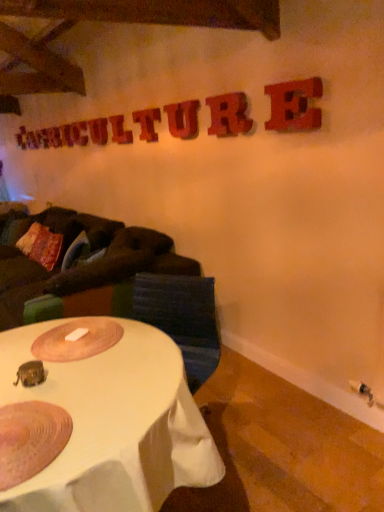
What do you see at coordinates (113, 425) in the screenshot? This screenshot has height=512, width=384. I see `white glossy table at lower left` at bounding box center [113, 425].

Where is `wooden letter at upper center, arranged as the fourth letter when viewed from the right`? The height and width of the screenshot is (512, 384). wooden letter at upper center, arranged as the fourth letter when viewed from the right is located at coordinates (147, 123).

What do you see at coordinates (67, 135) in the screenshot? I see `wooden letter at upper left, the first letter positioned from the back` at bounding box center [67, 135].

The height and width of the screenshot is (512, 384). What are the coordinates of `textured multicolored pillow at left` in the screenshot? It's located at (41, 245).

Where is `wooden sign at upper center, acting as the seventh letter starting from the front`? wooden sign at upper center, acting as the seventh letter starting from the front is located at coordinates (79, 133).

Measure the distance between point (82, 125) and camera.

The distance of point (82, 125) from camera is 14.40 feet.

Where is `white glossy table at lower left`? white glossy table at lower left is located at coordinates (113, 425).

Is point (207, 353) closer or farther from the camera than point (86, 127)?

Point (207, 353) appears to be closer to the viewer than point (86, 127).

Considering the sizes of objects textured fabric swivel chair at center and wooden sign at upper center, the 7th letter viewed from the right, in the image provided, who is bigger, textured fabric swivel chair at center or wooden sign at upper center, the 7th letter viewed from the right,?

textured fabric swivel chair at center is bigger.

Locate an element on the screen. swivel chair in front of the wooden sign at upper center, which appears as the second letter when viewed from the back is located at coordinates (182, 318).

Does textured fabric swivel chair at center have a lesser width compared to wooden sign at upper center, acting as the seventh letter starting from the front?

No.

From a real-world perspective, is rusty metal letter e at upper right, the 1th letter positioned from the front, on top of white glossy table at lower left?

Yes.

Can you confirm if rusty metal letter e at upper right, which is the 8th letter from left to right, is taller than white glossy table at lower left?

No.

From the image's perspective, between rusty metal letter e at upper right, the 1th letter positioned from the front, and white glossy table at lower left, who is located below?

white glossy table at lower left appears lower in the image.

Between rusty metal letter e at upper right, the 1th letter positioned from the front, and white glossy table at lower left, which one has smaller size?

With smaller size is rusty metal letter e at upper right, the 1th letter positioned from the front.

Are textured multicolored pillow at left and wooden letter at upper center, positioned as the fifth letter in back-to-front order, making contact?

No.

Between textured multicolored pillow at left and wooden letter at upper center, positioned as the fifth letter in back-to-front order, which one is positioned in front?

wooden letter at upper center, positioned as the fifth letter in back-to-front order, is closer to the camera.

From the image's perspective, does textured multicolored pillow at left appear lower than wooden letter at upper center, which is counted as the 5th letter, starting from the left?

Yes.

Is wooden letter at upper center, positioned as the fifth letter in back-to-front order, inside textured multicolored pillow at left?

No, wooden letter at upper center, positioned as the fifth letter in back-to-front order, is not surrounded by textured multicolored pillow at left.

Looking at this image, would you say wooden letter at upper center, the 4th letter positioned from the left, is part of wooden sign at upper center, the 7th letter viewed from the right,'s contents?

Actually, wooden letter at upper center, the 4th letter positioned from the left, is outside wooden sign at upper center, the 7th letter viewed from the right.

In the scene shown: Which object is positioned more to the right, wooden sign at upper center, acting as the seventh letter starting from the front, or wooden letter at upper center, the 4th letter positioned from the left?

wooden letter at upper center, the 4th letter positioned from the left, is more to the right.

How many degrees apart are the facing directions of wooden sign at upper center, the second letter when ordered from left to right, and wooden letter at upper center, which is the fifth letter from right to left?

The facing directions of wooden sign at upper center, the second letter when ordered from left to right, and wooden letter at upper center, which is the fifth letter from right to left, are 0.0197 degrees apart.

Consider the image. Could you tell me if rustic wood letter at upper center, the third letter when ordered from front to back, is facing wooden letter at upper center, the 4th letter positioned from the left?

No, rustic wood letter at upper center, the third letter when ordered from front to back, is not facing towards wooden letter at upper center, the 4th letter positioned from the left.

How different are the orientations of rustic wood letter at upper center, marked as the third letter in a right-to-left arrangement, and wooden letter at upper center, the fourth letter viewed from the back, in degrees?

The angle between the facing direction of rustic wood letter at upper center, marked as the third letter in a right-to-left arrangement, and the facing direction of wooden letter at upper center, the fourth letter viewed from the back, is 0.0303 degrees.

Can you confirm if rustic wood letter at upper center, the 6th letter viewed from the back, is wider than wooden letter at upper center, the 4th letter positioned from the left?

No, rustic wood letter at upper center, the 6th letter viewed from the back, is not wider than wooden letter at upper center, the 4th letter positioned from the left.

From the image's perspective, would you say rustic wood letter at upper center, the 6th letter viewed from the back, is positioned over wooden letter at upper center, the 5th letter in the front-to-back sequence?

No, from the image's perspective, rustic wood letter at upper center, the 6th letter viewed from the back, is not above wooden letter at upper center, the 5th letter in the front-to-back sequence.

Based on the photo, which object is wider, wooden letter at upper center, positioned as the sixth letter in right-to-left order, or dark brown fabric couch at left?

dark brown fabric couch at left.

Does wooden letter at upper center, the 6th letter from the front, touch dark brown fabric couch at left?

They are not placed beside each other.

Can you confirm if wooden letter at upper center, the 6th letter from the front, is positioned to the left of dark brown fabric couch at left?

In fact, wooden letter at upper center, the 6th letter from the front, is to the right of dark brown fabric couch at left.

Who is bigger, wooden letter at upper center, which is the 3th letter from back to front, or dark brown fabric couch at left?

dark brown fabric couch at left.

Considering the sizes of objects textured multicolored pillow at left and wooden sign at upper center, which appears as the second letter when viewed from the back, in the image provided, who is taller, textured multicolored pillow at left or wooden sign at upper center, which appears as the second letter when viewed from the back,?

textured multicolored pillow at left.

In terms of size, does textured multicolored pillow at left appear bigger or smaller than wooden sign at upper center, the second letter when ordered from left to right?

Clearly, textured multicolored pillow at left is larger in size than wooden sign at upper center, the second letter when ordered from left to right.

Based on the photo, from a real-world perspective, which is physically below, textured multicolored pillow at left or wooden sign at upper center, the second letter when ordered from left to right?

In real-world perspective, textured multicolored pillow at left is lower.

Where is `the 7th letter above the textured fabric swivel chair at center (from the image's perspective)`? This screenshot has width=384, height=512. the 7th letter above the textured fabric swivel chair at center (from the image's perspective) is located at coordinates (79, 133).

Where is `table that appears below the rusty metal letter e at upper right, which is the 8th letter from left to right (from a real-world perspective)`? table that appears below the rusty metal letter e at upper right, which is the 8th letter from left to right (from a real-world perspective) is located at coordinates (113, 425).

Based on their spatial positions, is dark brown fabric couch at left or wooden sign at upper center, the 7th letter viewed from the right, closer to textured multicolored pillow at left?

dark brown fabric couch at left.

Looking at the image, which one is located closer to wooden letter at upper center, the 5th letter in the front-to-back sequence, wooden letter at upper left, the first letter positioned from the back, or white glossy table at lower left?

wooden letter at upper left, the first letter positioned from the back, is closer to wooden letter at upper center, the 5th letter in the front-to-back sequence.

Considering their positions, is wooden letter at upper center, which is counted as the 5th letter, starting from the left, positioned further to textured fabric swivel chair at center than wooden letter at upper center, positioned as the sixth letter in right-to-left order?

wooden letter at upper center, positioned as the sixth letter in right-to-left order, is positioned further to the anchor textured fabric swivel chair at center.

Considering their positions, is textured fabric swivel chair at center positioned further to wooden letter at upper left, the eighth letter when ordered from front to back, than wooden letter at upper center, the 4th letter positioned from the left?

The object further to wooden letter at upper left, the eighth letter when ordered from front to back, is textured fabric swivel chair at center.

Considering their positions, is wooden letter at upper center, arranged as the fourth letter when viewed from the right, positioned closer to wooden letter at upper center, positioned as the sixth letter in right-to-left order, than textured fabric swivel chair at center?

Among the two, wooden letter at upper center, arranged as the fourth letter when viewed from the right, is located nearer to wooden letter at upper center, positioned as the sixth letter in right-to-left order.

Based on their spatial positions, is rusty metal letter e at upper right, which is the 8th letter from left to right, or dark brown fabric couch at left closer to wooden letter at upper center, acting as the 2th letter starting from the right?

Based on the image, rusty metal letter e at upper right, which is the 8th letter from left to right, appears to be nearer to wooden letter at upper center, acting as the 2th letter starting from the right.

Based on their spatial positions, is rusty metal letter e at upper right, marked as the 8th letter in a back-to-front arrangement, or textured fabric swivel chair at center further from wooden letter at upper center, which is the 3th letter from back to front?

textured fabric swivel chair at center is further to wooden letter at upper center, which is the 3th letter from back to front.

When comparing their distances from textured multicolored pillow at left, does rusty metal letter e at upper right, the 1th letter positioned from the front, or dark brown fabric couch at left seem closer?

dark brown fabric couch at left lies closer to textured multicolored pillow at left than the other object.

Identify the location of swivel chair between white glossy table at lower left and wooden letter at upper center, the 4th letter positioned from the left, along the z-axis. The width and height of the screenshot is (384, 512). (182, 318).

Find the location of a particular element. The height and width of the screenshot is (512, 384). pillow located between wooden letter at upper center, which is counted as the 5th letter, starting from the left, and wooden letter at upper left, the eighth letter when ordered from front to back, in the depth direction is located at coordinates 41,245.

Identify the location of letter between wooden letter at upper center, positioned as the fifth letter in back-to-front order, and wooden letter at upper center, which is the 3th letter from back to front, from front to back. (120, 130).

At what (x,y) coordinates should I click in order to perform the action: click on studio couch between white glossy table at lower left and wooden letter at upper left, the first letter positioned from the back, along the z-axis. Please return your answer as a coordinate pair (x, y). This screenshot has height=512, width=384. Looking at the image, I should click on (97, 274).